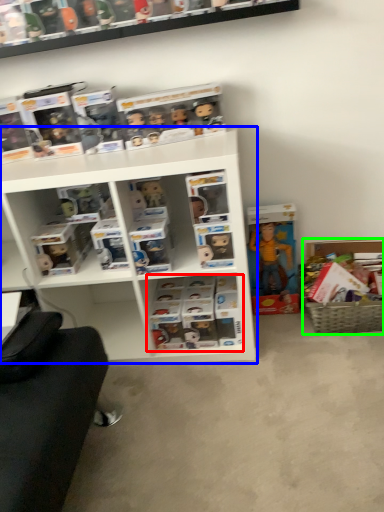
Question: Considering the real-world distances, which object is closest to book (highlighted by a red box)? shelf (highlighted by a blue box) or cabinet (highlighted by a green box).

Choices:
 (A) shelf
 (B) cabinet

Answer: (A)